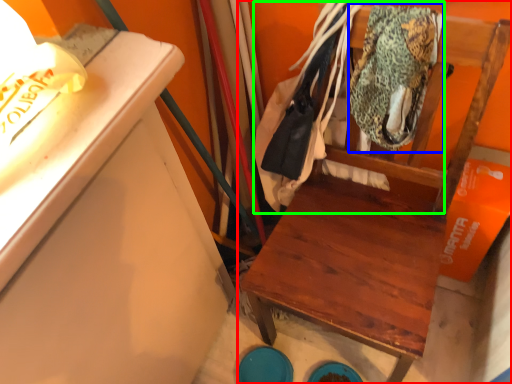
Question: Estimate the real-world distances between objects in this image. Which object is farther from furniture (highlighted by a red box), clothing (highlighted by a blue box) or laundry (highlighted by a green box)?

Choices:
 (A) clothing
 (B) laundry

Answer: (B)